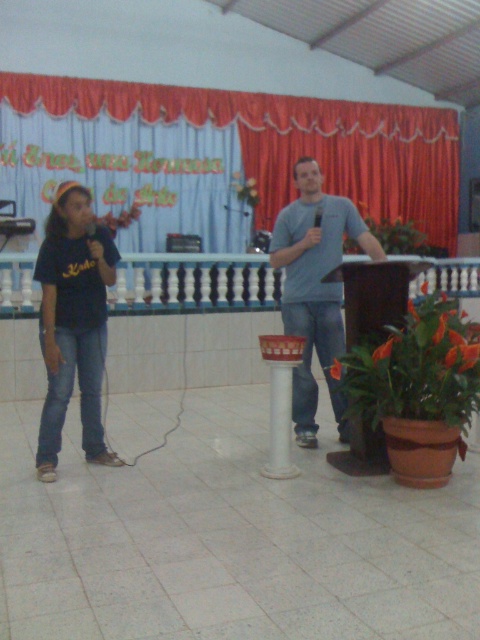
You are an event planner setting up a stage. You need to ensure that the blue fabric curtain at upper center and the white balustrade at center are positioned correctly. Which object should be placed higher to maintain the current visual hierarchy?

The blue fabric curtain at upper center should be placed higher because it is taller than the white balustrade at center, which helps maintain the visual hierarchy by emphasizing its prominence in the scene.

You are standing in the hall and want to move towards the blue fabric curtain at upper center located at point (291, 141). Which direction should you walk?

The blue fabric curtain at upper center is located at point (291, 141), so you should walk towards the upper center direction to reach it.